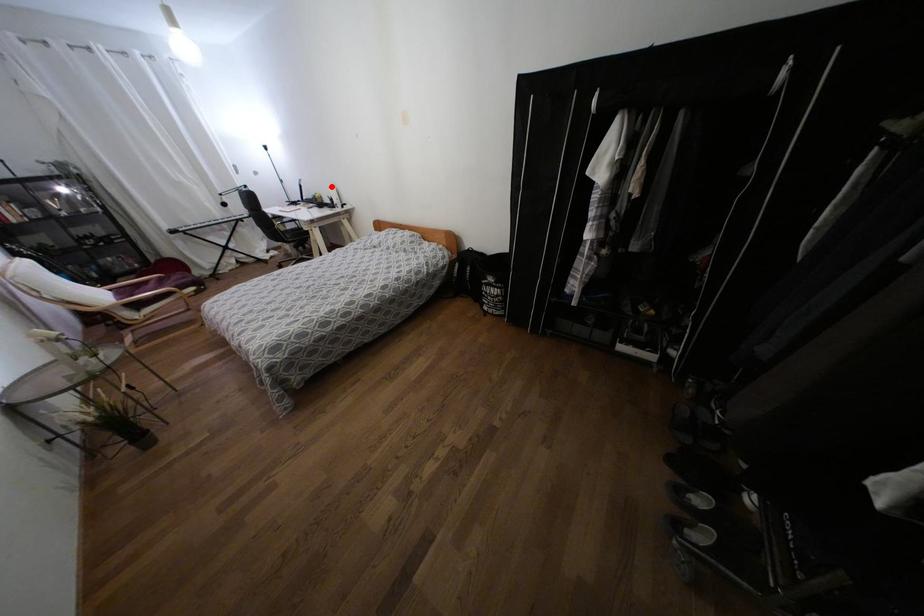
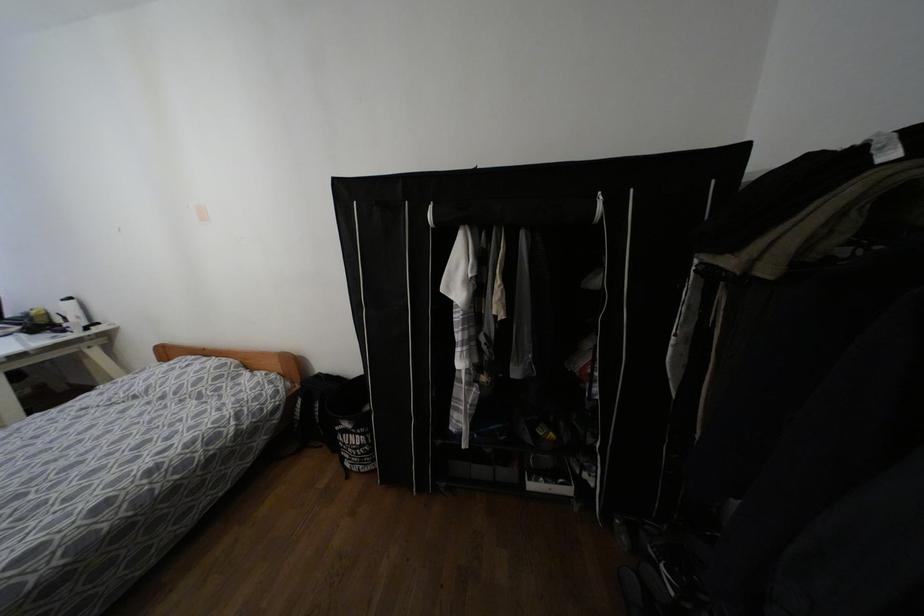
Question: I am providing you with two images of the same scene from different viewpoints. Image1 has a red point marked. In image2, the corresponding 3D location appears at what relative position? Reply with the corresponding letter.

Choices:
 (A) Closer
 (B) Farther

Answer: (B)